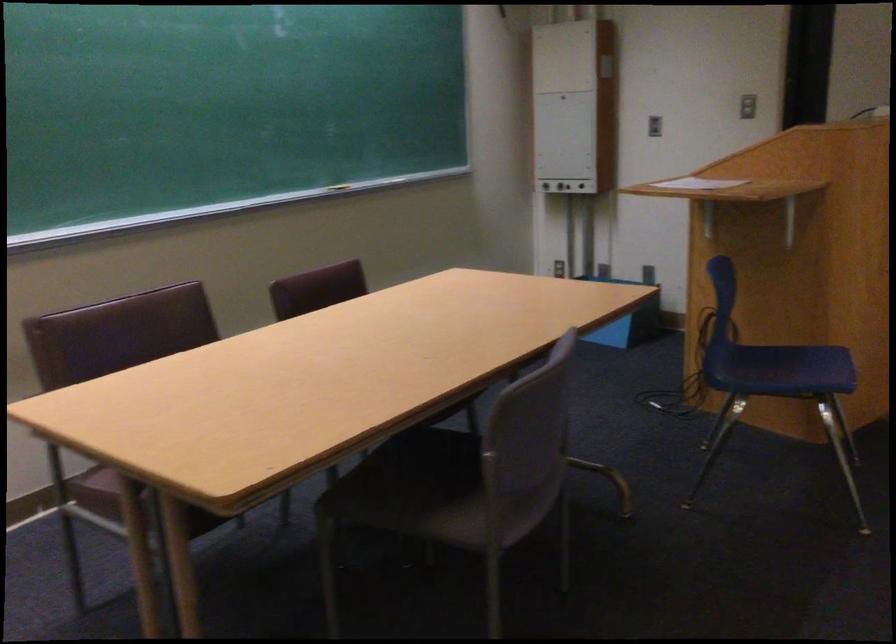
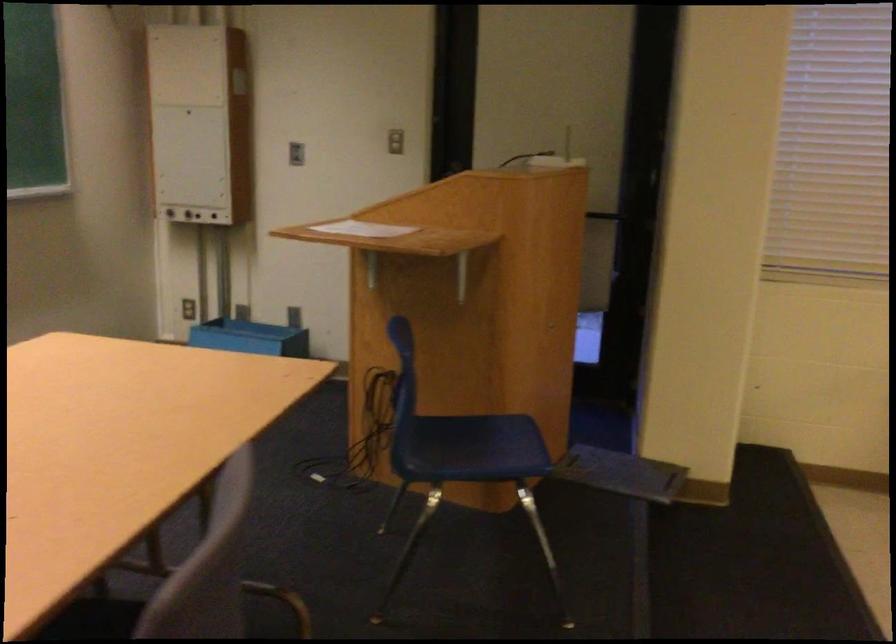
Question: The images are taken continuously from a first-person perspective. In which direction are you moving?

Choices:
 (A) Left
 (B) Right
 (C) Forward
 (D) Backward

Answer: (C)